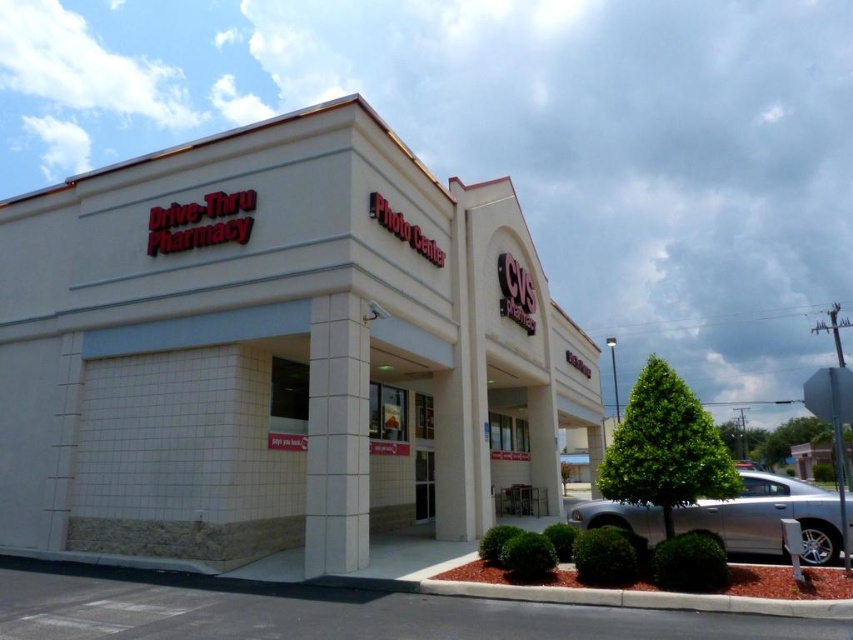
You are a customer arriving at the CVS Pharmacy and see the white tile building at center and the silver metallic sedan at lower right. Which object is closer to the entrance of the store?

The white tile building at center is closer to the entrance of the store because the silver metallic sedan at lower right is behind it.

You are a customer arriving at the CVS Pharmacy store. You see the white tile building at center and the silver metallic sedan at lower right. Which one is positioned more to the left side of the scene?

The white tile building at center is positioned to the left of the silver metallic sedan at lower right, so it is more to the left side of the scene.